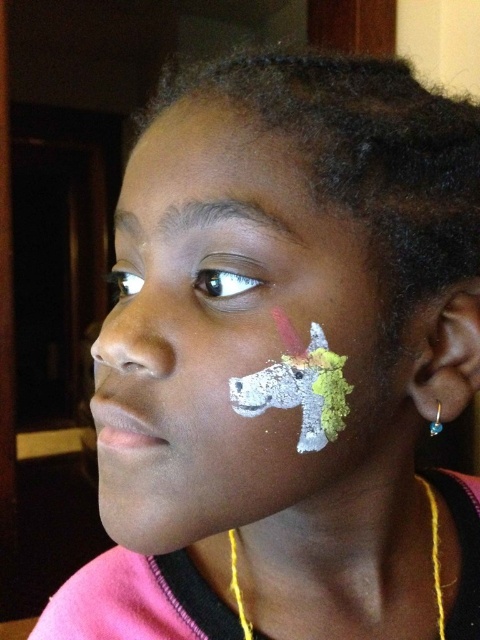
Looking at the young girl in the scene, which object is positioned lower on her face between the white matte unicorn face paint at lower right and the matte skin at upper center?

The white matte unicorn face paint at lower right is positioned below the matte skin at upper center, so it is lower on her face.

You are using a camera to take a photo of the young girl. The camera has a focus range of 12 inches. Can the camera focus on the point at point (242,509)?

The point at point (242,509) is 11.90 inches away from the camera. Since the camera requires a focus range of 12 inches, the camera cannot focus on the point at point (242,509) because it is slightly closer than the required distance.

You are a photographer taking a close up of the girl. The camera is focused on her face. You want to ensure the white matte unicorn face paint at lower right is in focus. Is it within the camera focus range of 10 inches? Please explain.

The white matte unicorn face paint at lower right is 10.37 inches from camera. Since the focus range is 10 inches, it is slightly out of focus. The photographer should move closer by 0.37 inches to ensure it is in focus.